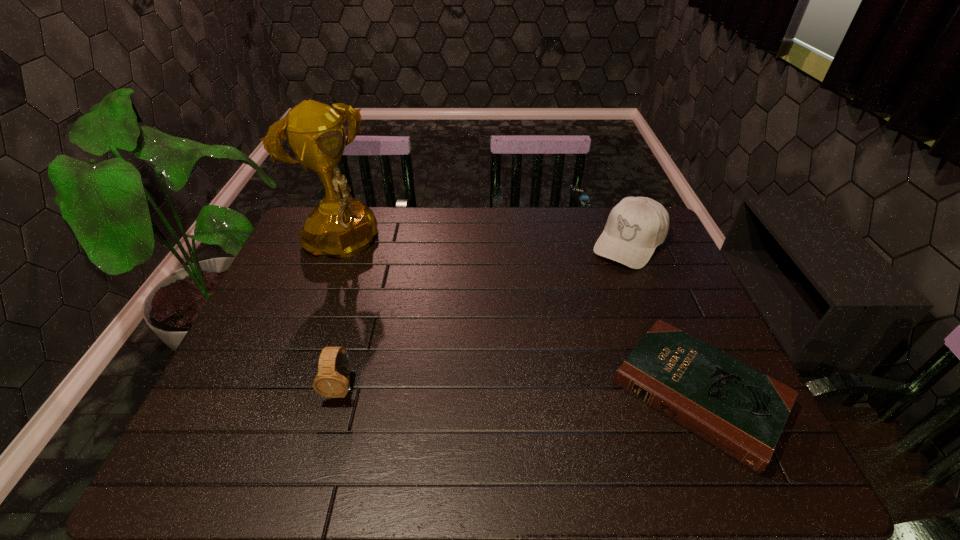
Locate an element on the screen. free space that is in between the baseball cap and the tallest object is located at coordinates (484, 245).

What are the coordinates of `vacant point located between the tallest object and the watch` in the screenshot? It's located at (341, 317).

Locate an element on the screen. This screenshot has height=540, width=960. empty location between the watch and the tallest object is located at coordinates (341, 317).

Where is `free point between the tallest object and the baseball cap`? free point between the tallest object and the baseball cap is located at coordinates tap(484, 245).

Where is `unoccupied position between the shortest object and the watch`? unoccupied position between the shortest object and the watch is located at coordinates (520, 391).

Identify which object is the nearest to the watch. Please provide its 2D coordinates. Your answer should be formatted as a tuple, i.e. [(x, y)], where the tuple contains the x and y coordinates of a point satisfying the conditions above.

[(341, 226)]

Locate which object ranks in proximity to the shortest object. Please provide its 2D coordinates. Your answer should be formatted as a tuple, i.e. [(x, y)], where the tuple contains the x and y coordinates of a point satisfying the conditions above.

[(636, 225)]

Locate an element on the screen. This screenshot has height=540, width=960. vacant point that satisfies the following two spatial constraints: 1. on the face of the watch; 2. on the right side of the shortest object is located at coordinates (340, 394).

Locate an element on the screen. vacant space that satisfies the following two spatial constraints: 1. on the front side of the shortest object; 2. on the right side of the award is located at coordinates (282, 394).

Where is `blank area in the image that satisfies the following two spatial constraints: 1. on the face of the watch; 2. on the left side of the shortest object`? The height and width of the screenshot is (540, 960). blank area in the image that satisfies the following two spatial constraints: 1. on the face of the watch; 2. on the left side of the shortest object is located at coordinates (340, 394).